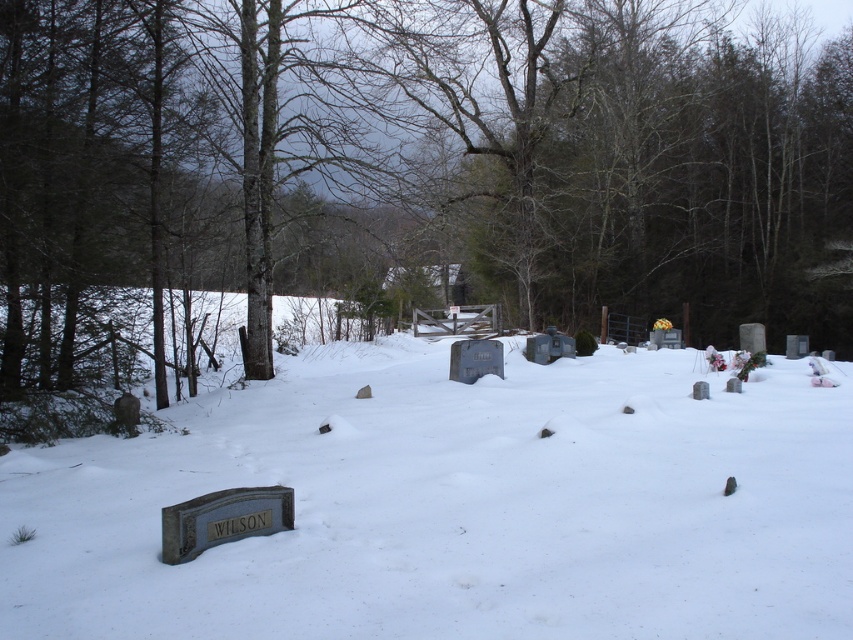
Describe the element at coordinates (407, 177) in the screenshot. I see `brown bark tree at center` at that location.

Is brown bark tree at center further to camera compared to white matte snow at lower left?

Yes.

Between point (163, 280) and point (125, 540), which one is positioned in front?

Point (125, 540)

Identify the location of brown bark tree at center. (407, 177).